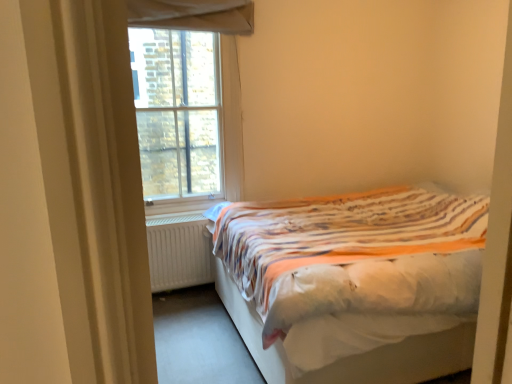
Question: Considering the positions of clear glass window at upper left and white fabric bed at right in the image, is clear glass window at upper left taller or shorter than white fabric bed at right?

Choices:
 (A) tall
 (B) short

Answer: (A)

Question: Based on their sizes in the image, would you say clear glass window at upper left is bigger or smaller than white fabric bed at right?

Choices:
 (A) big
 (B) small

Answer: (B)

Question: Which object is positioned closest to the white fabric bed at right?

Choices:
 (A) clear glass window at upper left
 (B) white matte radiator at lower left

Answer: (B)

Question: Which of these objects is positioned farthest from the white fabric bed at right?

Choices:
 (A) white matte radiator at lower left
 (B) clear glass window at upper left

Answer: (B)